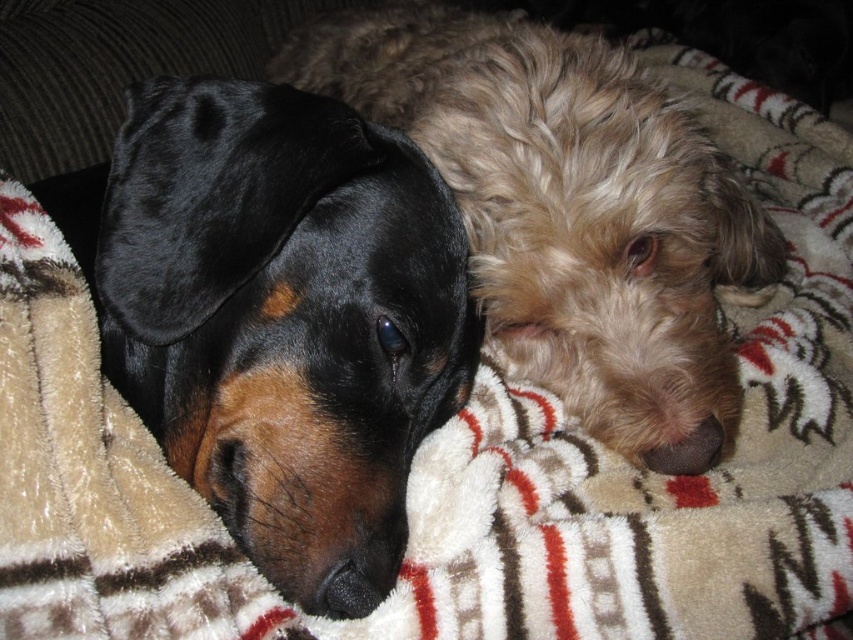
Does black velvet dog at left appear over shaggy beige dog at center?

Actually, black velvet dog at left is below shaggy beige dog at center.

Who is positioned more to the left, black velvet dog at left or shaggy beige dog at center?

From the viewer's perspective, black velvet dog at left appears more on the left side.

Identify the location of black velvet dog at left. The width and height of the screenshot is (853, 640). (285, 320).